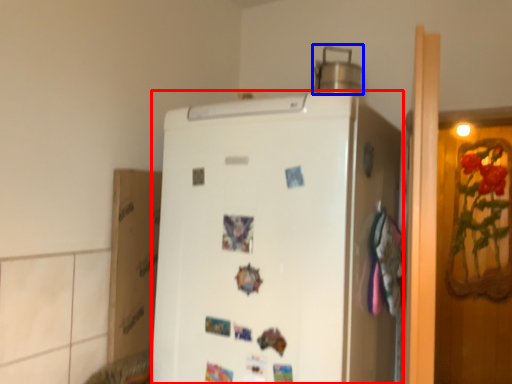
Question: Which object is further to the camera taking this photo, refrigerator (highlighted by a red box) or appliance (highlighted by a blue box)?

Choices:
 (A) refrigerator
 (B) appliance

Answer: (B)